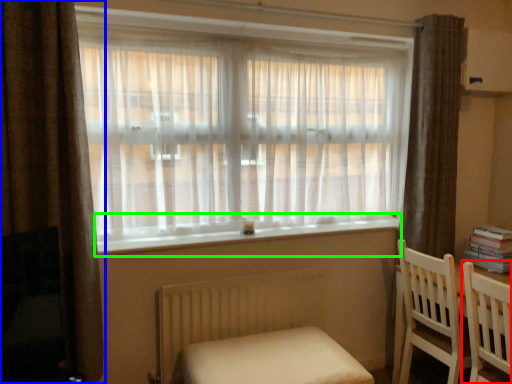
Question: Considering the real-world distances, which object is closest to chair (highlighted by a red box)? curtain (highlighted by a blue box) or window sill (highlighted by a green box).

Choices:
 (A) curtain
 (B) window sill

Answer: (B)